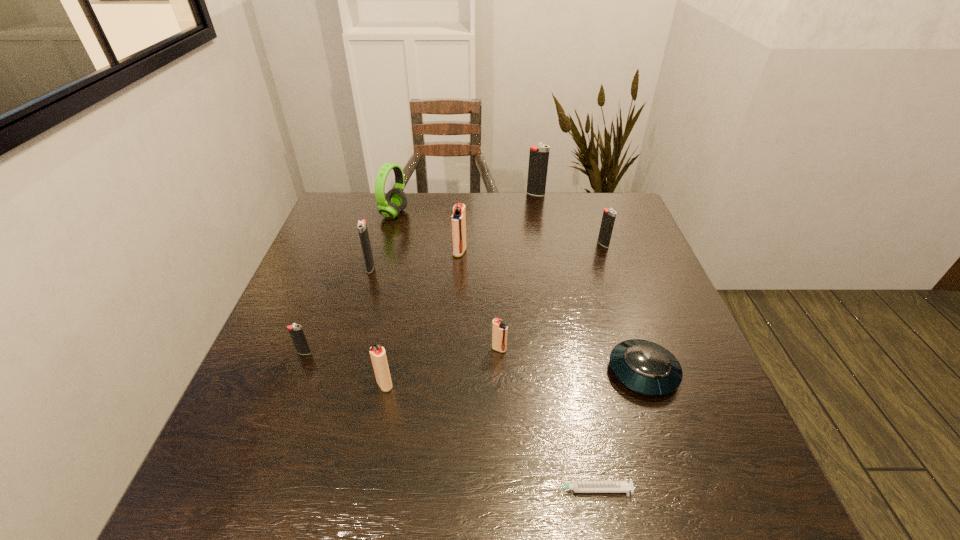
The width and height of the screenshot is (960, 540). Identify the location of the farthest object. (539, 155).

Find the location of `the third black igniter from left to right`. the third black igniter from left to right is located at coordinates (539, 155).

Image resolution: width=960 pixels, height=540 pixels. I want to click on headset, so click(x=396, y=200).

Find the location of a particular element. The height and width of the screenshot is (540, 960). the second farthest object is located at coordinates (396, 200).

The image size is (960, 540). I want to click on the second red igniter from right to left, so coord(458,219).

Locate an element on the screen. the farthest red igniter is located at coordinates (458, 219).

The image size is (960, 540). I want to click on the second igniter from left to right, so click(x=361, y=225).

You are a GUI agent. You are given a task and a screenshot of the screen. Output one action in this format:
    pyautogui.click(x=<x>, y=<y>)
    Task: Click on the fifth farthest object
    
    Given the screenshot: What is the action you would take?
    pyautogui.click(x=361, y=225)

Where is `the rightmost black igniter`? the rightmost black igniter is located at coordinates (609, 215).

At what (x,y) coordinates should I click in order to perform the action: click on the rightmost igniter. Please return your answer as a coordinate pair (x, y). This screenshot has height=540, width=960. Looking at the image, I should click on (609, 215).